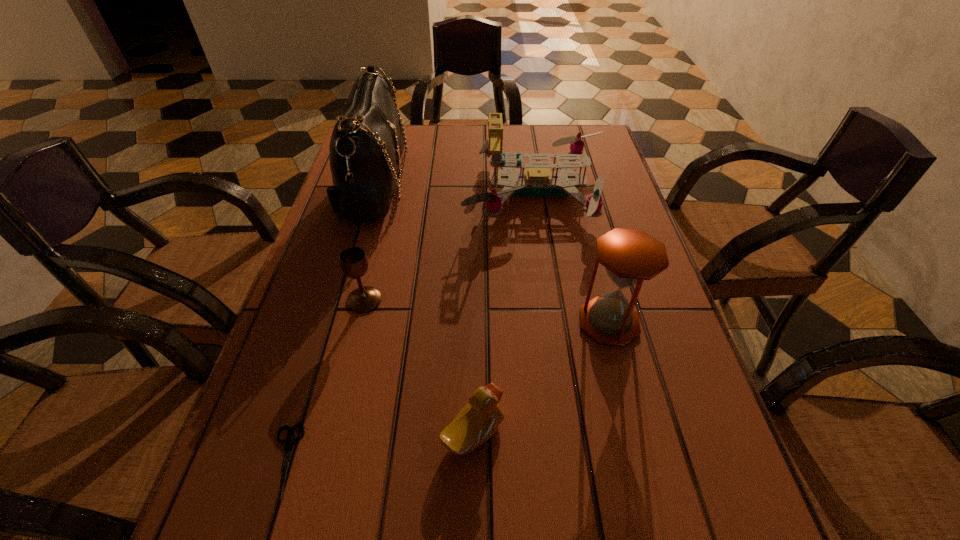
Where is `free spot between the drone and the tallest object`? Image resolution: width=960 pixels, height=540 pixels. free spot between the drone and the tallest object is located at coordinates (455, 189).

Identify the location of vacant area that lies between the fifth tallest object and the drone. The image size is (960, 540). (505, 312).

This screenshot has height=540, width=960. I want to click on vacant area that lies between the hourglass and the shears, so 446,392.

Image resolution: width=960 pixels, height=540 pixels. Identify the location of vacant area between the drone and the duck. (505, 312).

Identify the location of free space between the fourth tallest object and the handbag. This screenshot has height=540, width=960. (369, 244).

This screenshot has height=540, width=960. In order to click on vacant area that lies between the shears and the chalice in this screenshot , I will do `click(324, 380)`.

Locate an element on the screen. Image resolution: width=960 pixels, height=540 pixels. vacant area between the third shortest object and the hourglass is located at coordinates (487, 311).

Image resolution: width=960 pixels, height=540 pixels. I want to click on object that is the closest to the tallest object, so click(538, 180).

You are a GUI agent. You are given a task and a screenshot of the screen. Output one action in this format:
    pyautogui.click(x=<x>, y=<y>)
    Task: Click on the object that is the fifth closest to the tallest object
    The width and height of the screenshot is (960, 540).
    Given the screenshot: What is the action you would take?
    pyautogui.click(x=288, y=442)

The image size is (960, 540). What are the coordinates of `vacant region that satisfies the following two spatial constraints: 1. on the front-facing side of the hourglass; 2. on the left side of the drone` in the screenshot? It's located at pyautogui.click(x=557, y=322).